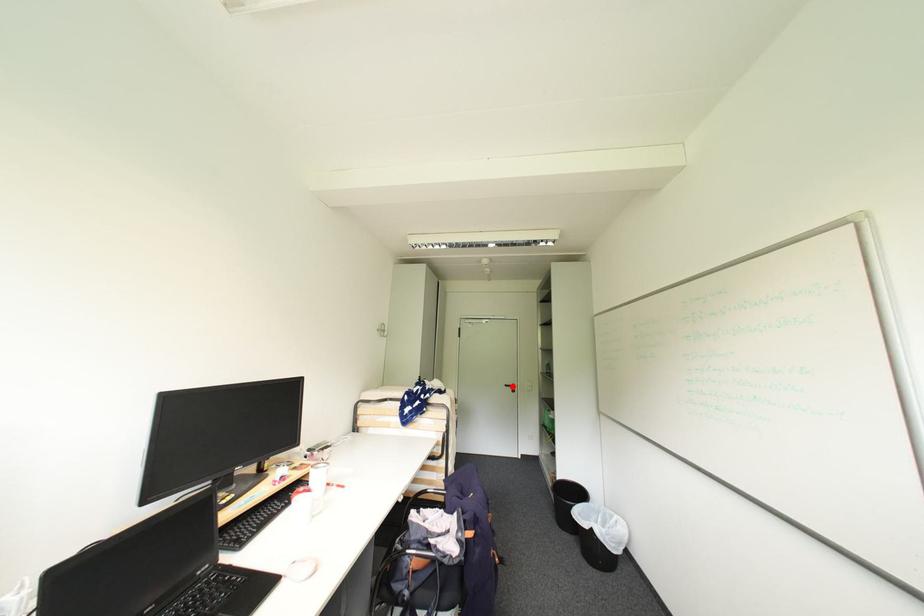
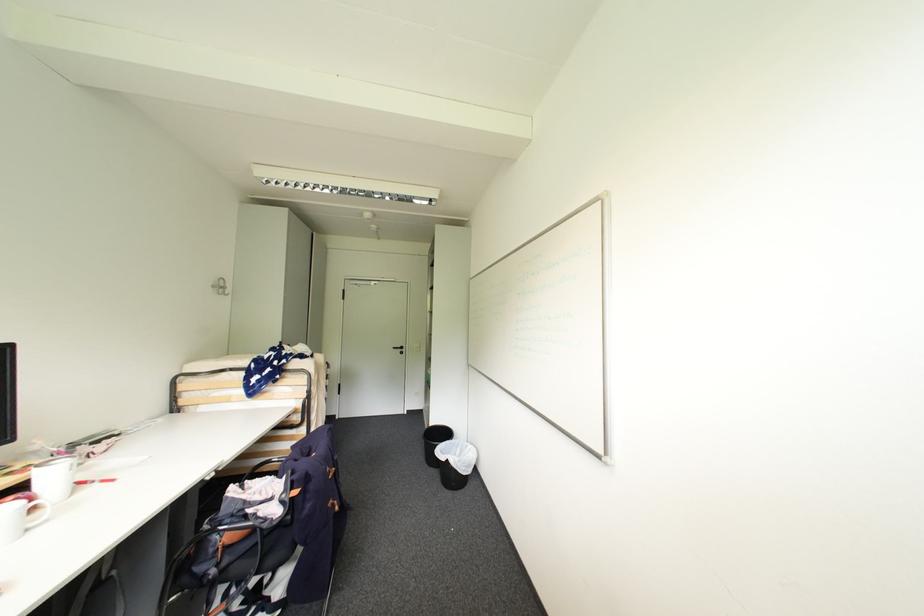
Question: I am providing you with two images of the same scene from different viewpoints. A red point is shown in image1. For the corresponding object point in image2, is it positioned nearer or farther from the camera?

Choices:
 (A) Nearer
 (B) Farther

Answer: (B)